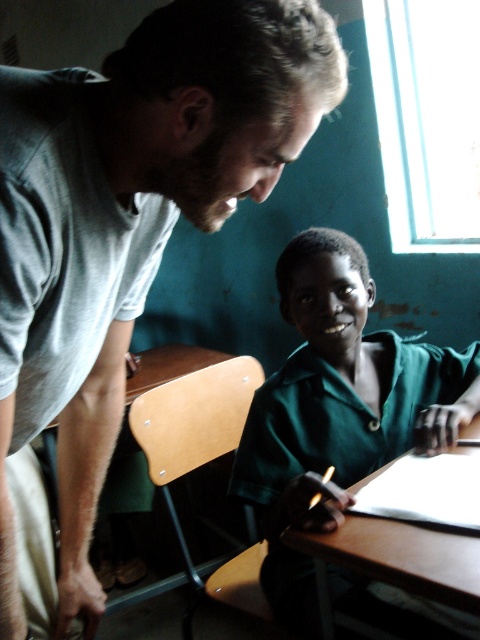
Question: Among these points, which one is nearest to the camera?

Choices:
 (A) (466, 584)
 (B) (95, 339)

Answer: (A)

Question: Can you confirm if green matte uniform at center is positioned to the left of brown wooden table at lower center?

Choices:
 (A) yes
 (B) no

Answer: (B)

Question: Considering the relative positions of gray cotton shirt at upper left and brown wooden table at lower center in the image provided, where is gray cotton shirt at upper left located with respect to brown wooden table at lower center?

Choices:
 (A) below
 (B) above

Answer: (B)

Question: Which point is farther to the camera?

Choices:
 (A) (327, 29)
 (B) (314, 536)

Answer: (B)

Question: Is gray cotton shirt at upper left wider than green matte uniform at center?

Choices:
 (A) yes
 (B) no

Answer: (B)

Question: Considering the real-world distances, which object is farthest from the brown wooden table at lower center?

Choices:
 (A) green matte uniform at center
 (B) gray cotton shirt at upper left

Answer: (B)